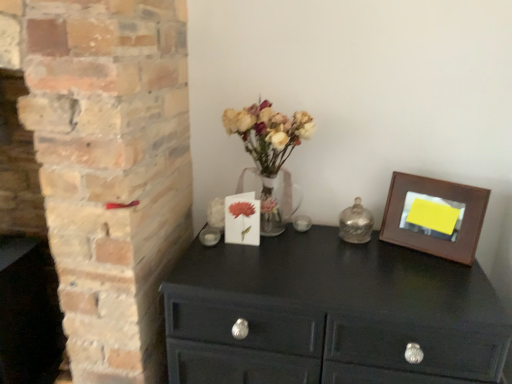
At what (x,y) coordinates should I click in order to perform the action: click on free point below translucent glass vase at center (from a real-world perspective). Please return your answer as a coordinate pair (x, y). Looking at the image, I should click on (280, 236).